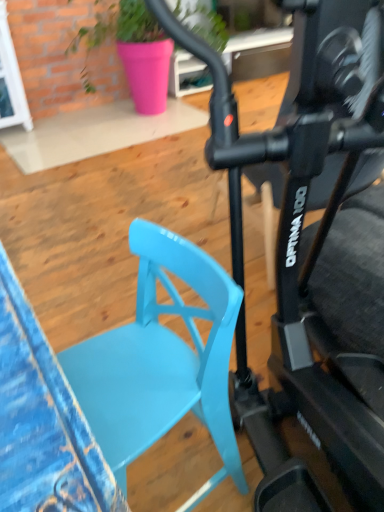
Image resolution: width=384 pixels, height=512 pixels. What are the coordinates of `white glossy glass door at upper left` in the screenshot? It's located at (11, 81).

Are white glossy glass door at upper left and matte blue chair at center-left making contact?

white glossy glass door at upper left is not next to matte blue chair at center-left, and they're not touching.

Who is shorter, white glossy glass door at upper left or matte blue chair at center-left?

With less height is matte blue chair at center-left.

How much distance is there between white glossy glass door at upper left and matte blue chair at center-left?

3.07 meters.

Which is more to the left, white glossy glass door at upper left or matte blue chair at center-left?

white glossy glass door at upper left.

Can you confirm if white glossy glass door at upper left is thinner than matte black exercise bike at center?

Yes, white glossy glass door at upper left is thinner than matte black exercise bike at center.

Considering the sizes of white glossy glass door at upper left and matte black exercise bike at center in the image, is white glossy glass door at upper left bigger or smaller than matte black exercise bike at center?

In the image, white glossy glass door at upper left appears to be smaller than matte black exercise bike at center.

Locate an element on the screen. The width and height of the screenshot is (384, 512). bicycle that appears below the white glossy glass door at upper left (from the image's perspective) is located at coordinates click(x=321, y=221).

Is white glossy glass door at upper left turned away from matte black exercise bike at center?

No.

From a real-world perspective, between pink ceramic pot at upper center and matte black exercise bike at center, who is vertically higher?

From a 3D spatial view, matte black exercise bike at center is above.

Is the depth of pink ceramic pot at upper center greater than that of matte black exercise bike at center?

Yes, it is behind matte black exercise bike at center.

Looking at this image, considering the relative positions of pink ceramic pot at upper center and matte black exercise bike at center in the image provided, is pink ceramic pot at upper center to the left or to the right of matte black exercise bike at center?

pink ceramic pot at upper center is to the left of matte black exercise bike at center.

Is matte blue chair at center-left far away from pink ceramic pot at upper center?

matte blue chair at center-left is positioned a significant distance from pink ceramic pot at upper center.

Between matte blue chair at center-left and pink ceramic pot at upper center, which one is positioned behind?

pink ceramic pot at upper center is more distant.

From the image's perspective, which one is positioned higher, matte blue chair at center-left or pink ceramic pot at upper center?

pink ceramic pot at upper center is shown above in the image.

In terms of height, does matte blue chair at center-left look taller or shorter compared to pink ceramic pot at upper center?

In the image, matte blue chair at center-left appears to be shorter than pink ceramic pot at upper center.

In the scene shown: Considering the positions of objects white glossy glass door at upper left and pink ceramic pot at upper center in the image provided, who is behind, white glossy glass door at upper left or pink ceramic pot at upper center?

white glossy glass door at upper left is further away from the camera.

Looking at this image, could you tell me if white glossy glass door at upper left is facing pink ceramic pot at upper center?

No, white glossy glass door at upper left is not oriented towards pink ceramic pot at upper center.

Consider the image. Considering the positions of objects white glossy glass door at upper left and pink ceramic pot at upper center in the image provided, who is more to the left, white glossy glass door at upper left or pink ceramic pot at upper center?

white glossy glass door at upper left.

Who is smaller, white glossy glass door at upper left or pink ceramic pot at upper center?

Smaller between the two is white glossy glass door at upper left.

Which is less distant, (325, 399) or (150, 365)?

Point (325, 399) is positioned farther from the camera compared to point (150, 365).

Is matte black exercise bike at center bigger or smaller than matte blue chair at center-left?

Clearly, matte black exercise bike at center is larger in size than matte blue chair at center-left.

Is matte black exercise bike at center completely or partially outside of matte blue chair at center-left?

Yes.

From the image's perspective, is matte black exercise bike at center located beneath pink ceramic pot at upper center?

Indeed, from the image's perspective, matte black exercise bike at center is shown beneath pink ceramic pot at upper center.

Which is nearer, [320,237] or [90,82]?

Point [320,237] is positioned closer to the camera compared to point [90,82].

Which is more to the right, matte black exercise bike at center or pink ceramic pot at upper center?

Positioned to the right is matte black exercise bike at center.

The height and width of the screenshot is (512, 384). I want to click on glass door above the matte blue chair at center-left (from the image's perspective), so click(x=11, y=81).

Locate an element on the screen. glass door beneath the matte black exercise bike at center (from a real-world perspective) is located at coordinates (11, 81).

Estimate the real-world distances between objects in this image. Which object is further from pink ceramic pot at upper center, white glossy glass door at upper left or matte black exercise bike at center?

Based on the image, matte black exercise bike at center appears to be further to pink ceramic pot at upper center.

When comparing their distances from matte black exercise bike at center, does white glossy glass door at upper left or pink ceramic pot at upper center seem further?

Among the two, white glossy glass door at upper left is located further to matte black exercise bike at center.

Estimate the real-world distances between objects in this image. Which object is further from matte blue chair at center-left, white glossy glass door at upper left or matte black exercise bike at center?

white glossy glass door at upper left is positioned further to the anchor matte blue chair at center-left.

Based on their spatial positions, is matte blue chair at center-left or matte black exercise bike at center further from white glossy glass door at upper left?

matte blue chair at center-left is further to white glossy glass door at upper left.

From the picture: Considering their positions, is pink ceramic pot at upper center positioned closer to matte black exercise bike at center than white glossy glass door at upper left?

Among the two, pink ceramic pot at upper center is located nearer to matte black exercise bike at center.

Estimate the real-world distances between objects in this image. Which object is closer to matte black exercise bike at center, pink ceramic pot at upper center or matte blue chair at center-left?

The object closer to matte black exercise bike at center is matte blue chair at center-left.

Estimate the real-world distances between objects in this image. Which object is further from white glossy glass door at upper left, matte black exercise bike at center or matte blue chair at center-left?

matte blue chair at center-left is positioned further to the anchor white glossy glass door at upper left.

Looking at the image, which one is located closer to matte blue chair at center-left, pink ceramic pot at upper center or matte black exercise bike at center?

matte black exercise bike at center lies closer to matte blue chair at center-left than the other object.

At what (x,y) coordinates should I click in order to perform the action: click on houseplant positioned between matte black exercise bike at center and white glossy glass door at upper left from near to far. Please return your answer as a coordinate pair (x, y). The height and width of the screenshot is (512, 384). Looking at the image, I should click on (134, 49).

Image resolution: width=384 pixels, height=512 pixels. I want to click on chair between matte black exercise bike at center and pink ceramic pot at upper center from front to back, so click(x=161, y=361).

You are a GUI agent. You are given a task and a screenshot of the screen. Output one action in this format:
    pyautogui.click(x=<x>, y=<y>)
    Task: Click on the houseplant located between matte blue chair at center-left and white glossy glass door at upper left in the depth direction
    
    Given the screenshot: What is the action you would take?
    pyautogui.click(x=134, y=49)

Where is `chair positioned between matte black exercise bike at center and white glossy glass door at upper left from near to far`? Image resolution: width=384 pixels, height=512 pixels. chair positioned between matte black exercise bike at center and white glossy glass door at upper left from near to far is located at coordinates (161, 361).